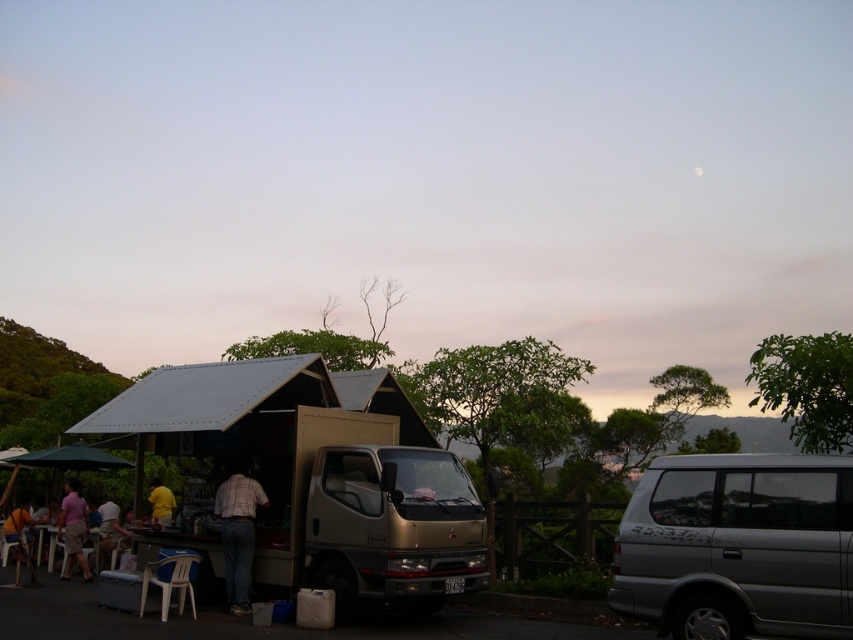
Question: Does silver metallic minivan at right have a smaller size compared to yellow shirt at center?

Choices:
 (A) yes
 (B) no

Answer: (B)

Question: Which object appears closest to the camera in this image?

Choices:
 (A) plaid shirt at center
 (B) yellow shirt at center
 (C) silver metallic minivan at right

Answer: (C)

Question: Which object appears farthest from the camera in this image?

Choices:
 (A) yellow shirt at center
 (B) pink fabric shirt at lower left
 (C) gold metallic van at center

Answer: (B)

Question: Can you confirm if white plastic table at lower left is positioned to the right of light brown plastic chair at lower left?

Choices:
 (A) no
 (B) yes

Answer: (B)

Question: Is metallic silver hut at center below plaid shirt at center?

Choices:
 (A) no
 (B) yes

Answer: (A)

Question: Which of the following is the closest to the observer?

Choices:
 (A) yellow shirt at center
 (B) plaid shirt at center
 (C) gold metallic van at center

Answer: (C)